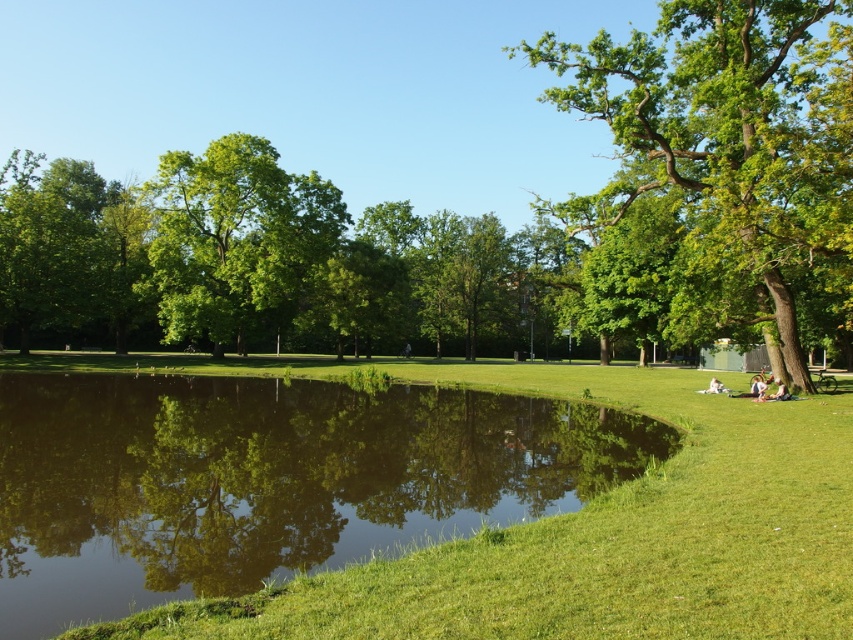
Is point (196, 493) positioned after point (70, 285)?

No.

At what (x,y) coordinates should I click in order to perform the action: click on green reflective water at center. Please return your answer as a coordinate pair (x, y). Looking at the image, I should click on pos(265,481).

Locate an element on the screen. The height and width of the screenshot is (640, 853). green reflective water at center is located at coordinates 265,481.

Can you confirm if green reflective water at center is smaller than green leafy tree at center?

Yes.

Who is more forward, (374, 497) or (163, 172)?

Positioned in front is point (374, 497).

Between point (96, 566) and point (163, 305), which one is positioned behind?

Positioned behind is point (163, 305).

This screenshot has width=853, height=640. Identify the location of green reflective water at center. (265, 481).

Does green leafy tree at right appear over green leafy tree at center?

Correct, green leafy tree at right is located above green leafy tree at center.

Is green leafy tree at right taller than green leafy tree at center?

Yes, green leafy tree at right is taller than green leafy tree at center.

Is point (701, 198) behind point (219, 342)?

That is False.

In order to click on green leafy tree at right in this screenshot , I will do `click(727, 134)`.